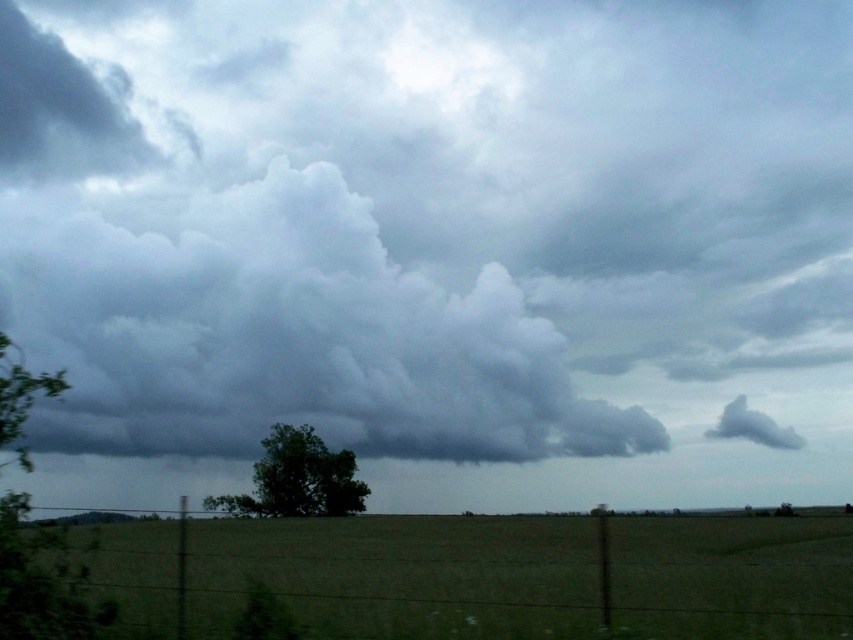
Question: Which point is closer to the camera?

Choices:
 (A) green leafy tree at left
 (B) green grass at lower center

Answer: (A)

Question: Is green grass at lower center above green leafy tree at left?

Choices:
 (A) yes
 (B) no

Answer: (B)

Question: From the image, what is the correct spatial relationship of gray fluffy cloud at upper center in relation to gray fluffy cloud at upper right?

Choices:
 (A) right
 (B) left

Answer: (B)

Question: Is gray fluffy cloud at upper center to the right of green leafy tree at left from the viewer's perspective?

Choices:
 (A) no
 (B) yes

Answer: (A)

Question: Which point appears closest to the camera in this image?

Choices:
 (A) (729, 417)
 (B) (41, 547)

Answer: (B)

Question: Which point appears closest to the camera in this image?

Choices:
 (A) (668, 582)
 (B) (737, 432)
 (C) (77, 300)
 (D) (38, 602)

Answer: (D)